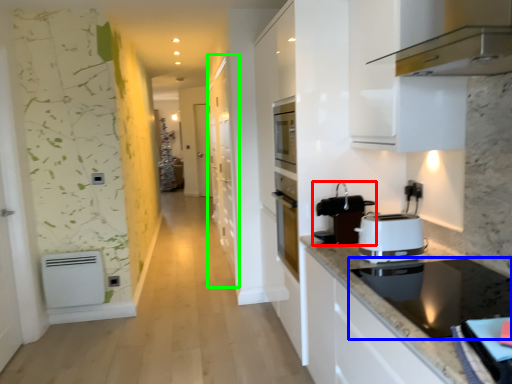
Question: Estimate the real-world distances between objects in this image. Which object is farther from kitchen appliance (highlighted by a red box), home appliance (highlighted by a blue box) or cabinetry (highlighted by a green box)?

Choices:
 (A) home appliance
 (B) cabinetry

Answer: (B)